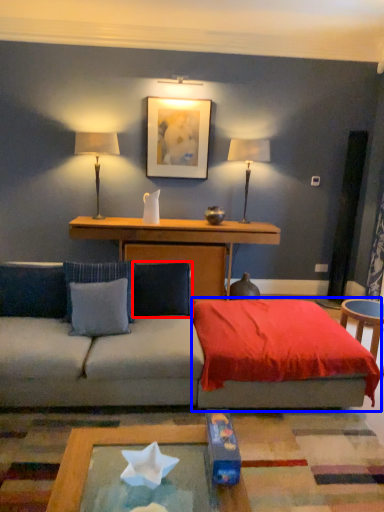
Question: Among these objects, which one is nearest to the camera, pillow (highlighted by a red box) or bedding (highlighted by a blue box)?

Choices:
 (A) pillow
 (B) bedding

Answer: (B)